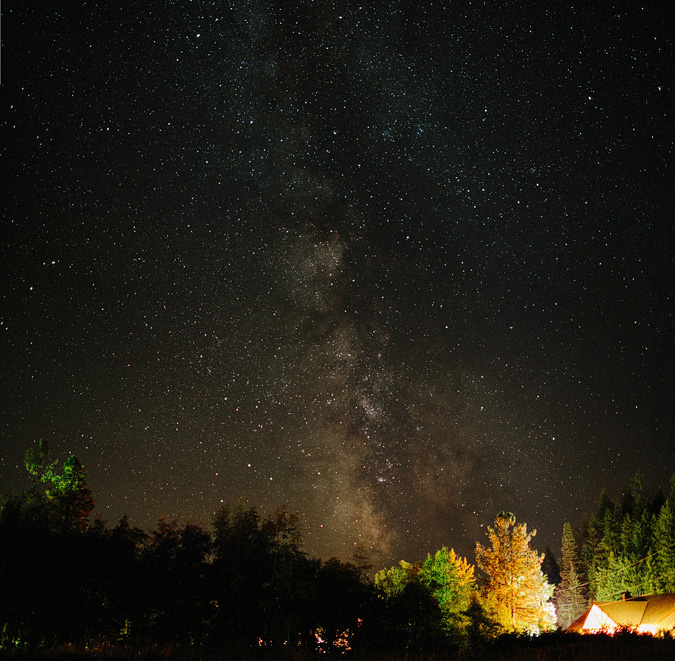
At what (x,y) coordinates should I click in order to perform the action: click on chimney. Please return your answer as a coordinate pair (x, y). Looking at the image, I should click on (624, 595).